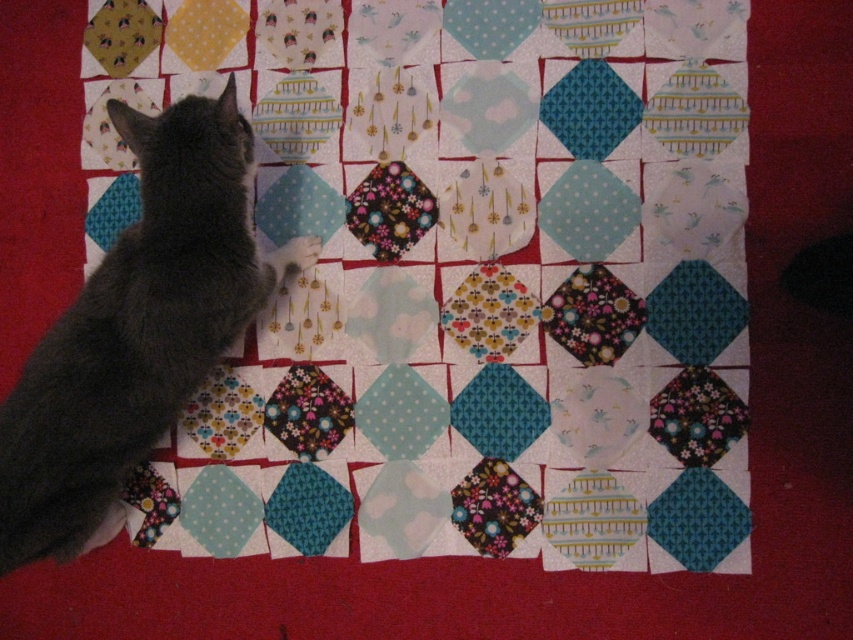
Which is behind, point (85, 316) or point (306, 240)?

Point (306, 240)

Can you confirm if dark gray fur cat at left is taller than fluffy gray paw at center?

Yes.

Which is in front, point (80, 298) or point (305, 237)?

Point (80, 298) is in front.

The height and width of the screenshot is (640, 853). Find the location of `dark gray fur cat at left`. dark gray fur cat at left is located at coordinates (134, 332).